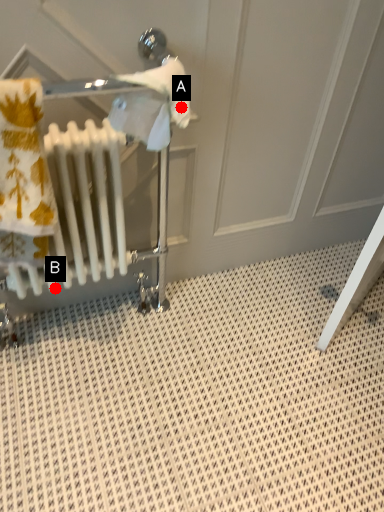
Question: Two points are circled on the image, labeled by A and B beside each circle. Which point is closer to the camera?

Choices:
 (A) A is closer
 (B) B is closer

Answer: (A)